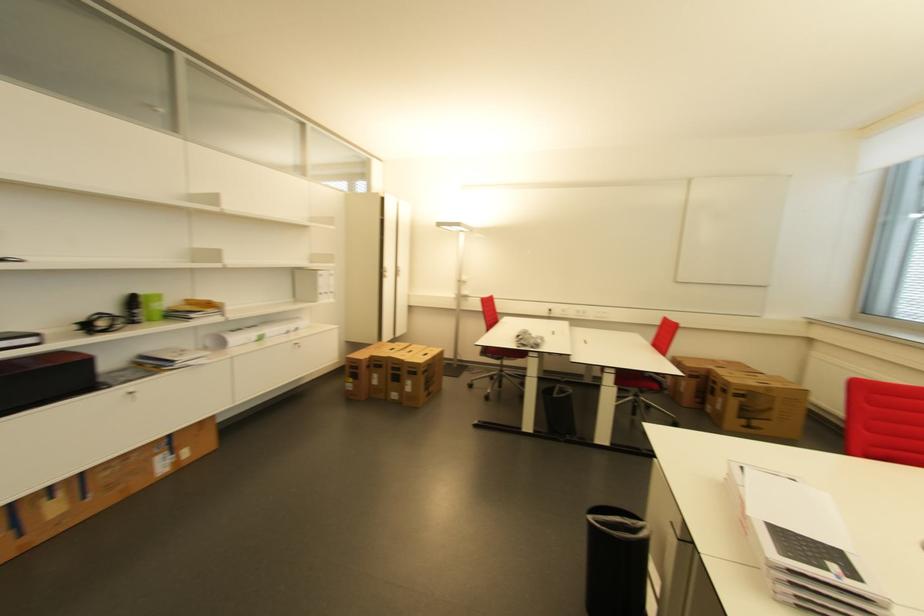
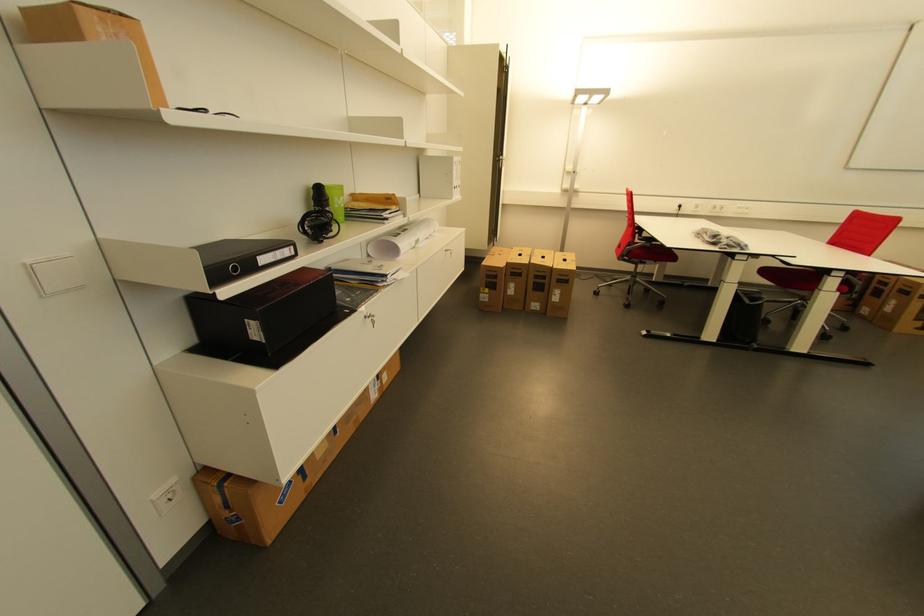
Find the pixel in the second image that matches [362,369] in the first image.

(502, 278)